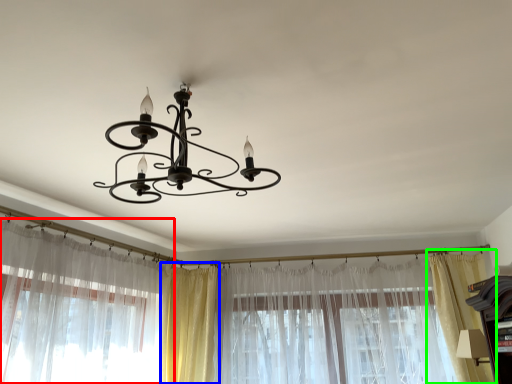
Question: Which object is positioned closest to curtain (highlighted by a red box)? Select from curtain (highlighted by a blue box) and curtain (highlighted by a green box).

Choices:
 (A) curtain
 (B) curtain

Answer: (A)